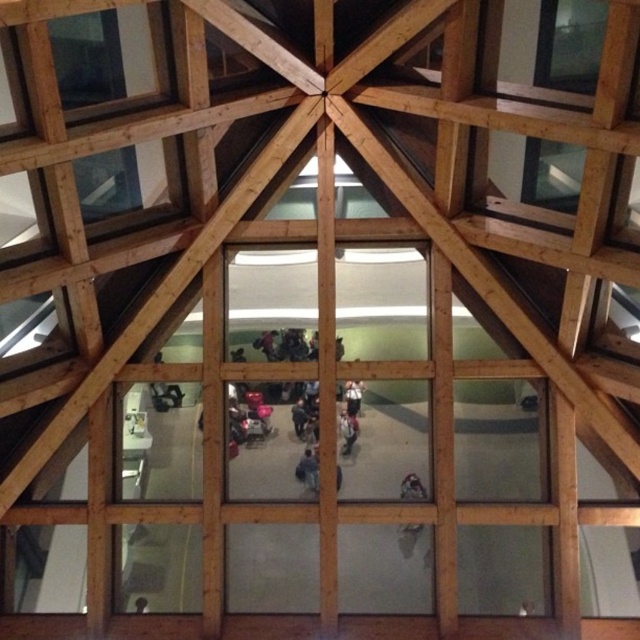
Can you confirm if dark gray fabric jacket at center is positioned to the left of light brown leather jacket at center?

Indeed, dark gray fabric jacket at center is positioned on the left side of light brown leather jacket at center.

Which is in front, point (308, 416) or point (340, 417)?

Point (340, 417) is in front.

Between point (300, 404) and point (355, 417), which one is positioned behind?

The point (300, 404) is behind.

The image size is (640, 640). Find the location of `dark gray fabric jacket at center`. dark gray fabric jacket at center is located at coordinates (301, 417).

Does point (305, 481) come closer to viewer compared to point (349, 417)?

Yes, point (305, 481) is closer to viewer.

Is point (310, 488) farther from camera compared to point (349, 429)?

No, (310, 488) is in front of (349, 429).

You are a GUI agent. You are given a task and a screenshot of the screen. Output one action in this format:
    pyautogui.click(x=<x>, y=<y>)
    Task: Click on the dark blue jeans at center
    This screenshot has width=640, height=640.
    Given the screenshot: What is the action you would take?
    pyautogui.click(x=307, y=468)

Who is taller, dark blue jeans at center or dark gray fabric jacket at center?

dark blue jeans at center is taller.

Can you confirm if dark blue jeans at center is shorter than dark gray fabric jacket at center?

In fact, dark blue jeans at center may be taller than dark gray fabric jacket at center.

At what (x,y) coordinates should I click in order to perform the action: click on dark blue jeans at center. Please return your answer as a coordinate pair (x, y). The height and width of the screenshot is (640, 640). Looking at the image, I should click on (307, 468).